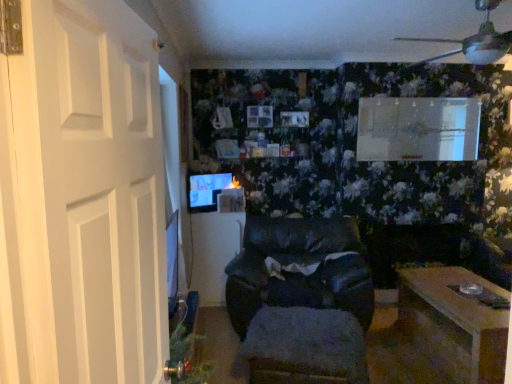
Question: Does white matte door at left turn towards matte black monitor at center?

Choices:
 (A) yes
 (B) no

Answer: (B)

Question: Considering the relative sizes of white matte door at left and matte black monitor at center in the image provided, is white matte door at left taller than matte black monitor at center?

Choices:
 (A) yes
 (B) no

Answer: (A)

Question: From a real-world perspective, is white matte door at left physically below matte black monitor at center?

Choices:
 (A) no
 (B) yes

Answer: (A)

Question: From a real-world perspective, is white matte door at left on top of matte black monitor at center?

Choices:
 (A) yes
 (B) no

Answer: (A)

Question: Is white matte door at left at the left side of matte black monitor at center?

Choices:
 (A) no
 (B) yes

Answer: (A)

Question: In terms of size, does fuzzy fabric footrest at center appear bigger or smaller than black leather chair at center?

Choices:
 (A) small
 (B) big

Answer: (A)

Question: From the image's perspective, is fuzzy fabric footrest at center located above or below black leather chair at center?

Choices:
 (A) below
 (B) above

Answer: (A)

Question: Is fuzzy fabric footrest at center to the left or to the right of black leather chair at center in the image?

Choices:
 (A) left
 (B) right

Answer: (A)

Question: Looking at their shapes, would you say fuzzy fabric footrest at center is wider or thinner than black leather chair at center?

Choices:
 (A) thin
 (B) wide

Answer: (A)

Question: Considering the positions of black leather chair at center and matte black monitor at center in the image, is black leather chair at center taller or shorter than matte black monitor at center?

Choices:
 (A) short
 (B) tall

Answer: (B)

Question: In terms of width, does black leather chair at center look wider or thinner when compared to matte black monitor at center?

Choices:
 (A) wide
 (B) thin

Answer: (A)

Question: From a real-world perspective, relative to matte black monitor at center, is black leather chair at center vertically above or below?

Choices:
 (A) above
 (B) below

Answer: (B)

Question: Looking at the image, does black leather chair at center seem bigger or smaller compared to matte black monitor at center?

Choices:
 (A) big
 (B) small

Answer: (A)

Question: Which is correct: black leather chair at center is inside white matte door at left, or outside of it?

Choices:
 (A) outside
 (B) inside

Answer: (A)

Question: From the image's perspective, relative to white matte door at left, is black leather chair at center above or below?

Choices:
 (A) below
 (B) above

Answer: (A)